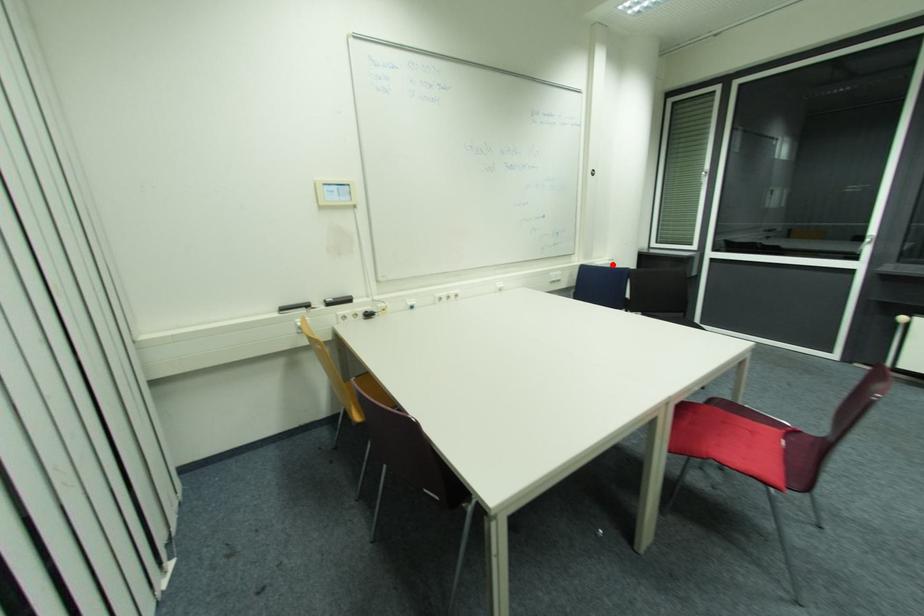
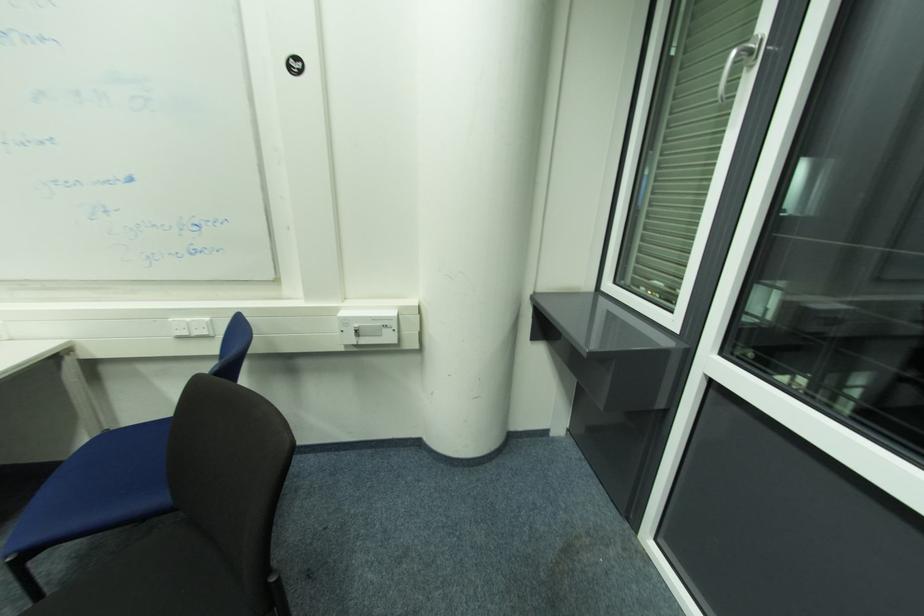
In the second image, find the point that corresponds to the highlighted location in the first image.

(378, 320)